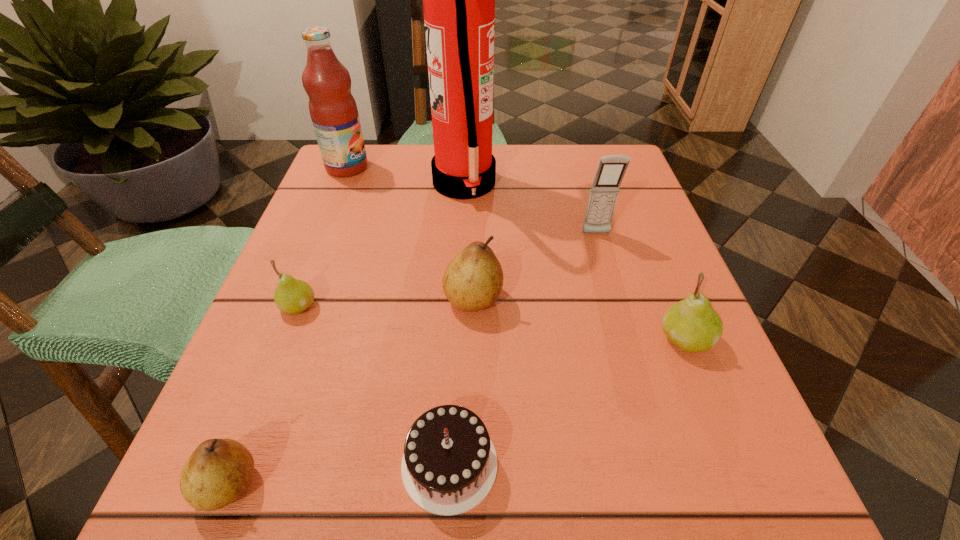
The width and height of the screenshot is (960, 540). Find the location of `unoccupied position between the sixth nearest object and the rightmost pear`. unoccupied position between the sixth nearest object and the rightmost pear is located at coordinates coord(641,287).

Where is `free spot between the rightmost object and the fruit juice`? This screenshot has height=540, width=960. free spot between the rightmost object and the fruit juice is located at coordinates (516, 253).

You are a GUI agent. You are given a task and a screenshot of the screen. Output one action in this format:
    pyautogui.click(x=<x>, y=<y>)
    Task: Click on the free space that is in between the seventh shortest object and the tallest object
    
    Given the screenshot: What is the action you would take?
    pyautogui.click(x=405, y=176)

Identify the location of free space between the smaller brown pear and the red fire extinguisher. This screenshot has height=540, width=960. (347, 334).

This screenshot has height=540, width=960. In order to click on unoccupied area between the third tallest object and the nearer brown pear in this screenshot , I will do (x=413, y=359).

Locate an element on the screen. unoccupied position between the second tallest object and the chocolate cake is located at coordinates [398, 315].

At what (x,y) coordinates should I click in order to perform the action: click on free space between the second tallest object and the nearer brown pear. Please return your answer as a coordinate pair (x, y). The image size is (960, 540). Looking at the image, I should click on (288, 326).

Locate an element on the screen. This screenshot has width=960, height=540. object that is the sixth nearest to the left green pear is located at coordinates (611, 169).

The width and height of the screenshot is (960, 540). In order to click on the second closest object to the chocolate cake in this screenshot , I will do `click(473, 280)`.

Choose which pear is the third nearest neighbor to the chocolate cake. Please provide its 2D coordinates. Your answer should be formatted as a tuple, i.e. [(x, y)], where the tuple contains the x and y coordinates of a point satisfying the conditions above.

[(292, 296)]